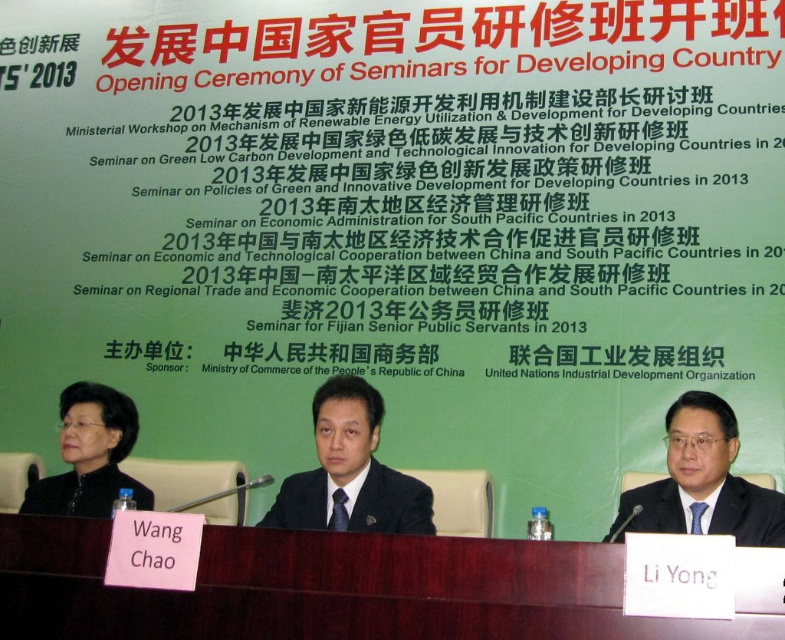
Question: Can you confirm if black matte jacket at lower left is smaller than black matte suit at center?

Choices:
 (A) yes
 (B) no

Answer: (A)

Question: Observing the image, what is the correct spatial positioning of brown wood table at center in reference to black matte suit at center?

Choices:
 (A) right
 (B) left

Answer: (B)

Question: Can you confirm if dark suit at center is positioned to the left of dark blue suit at right?

Choices:
 (A) yes
 (B) no

Answer: (A)

Question: Considering the real-world distances, which object is farthest from the brown wood table at center?

Choices:
 (A) black matte suit at center
 (B) black matte business suit at left
 (C) black silk suit at center

Answer: (B)

Question: Which point is closer to the camera taking this photo?

Choices:
 (A) (207, 557)
 (B) (90, 420)
 (C) (619, 516)

Answer: (A)

Question: Which of the following is the closest to the observer?

Choices:
 (A) (444, 614)
 (B) (736, 541)
 (C) (79, 502)
 (D) (294, 486)

Answer: (A)